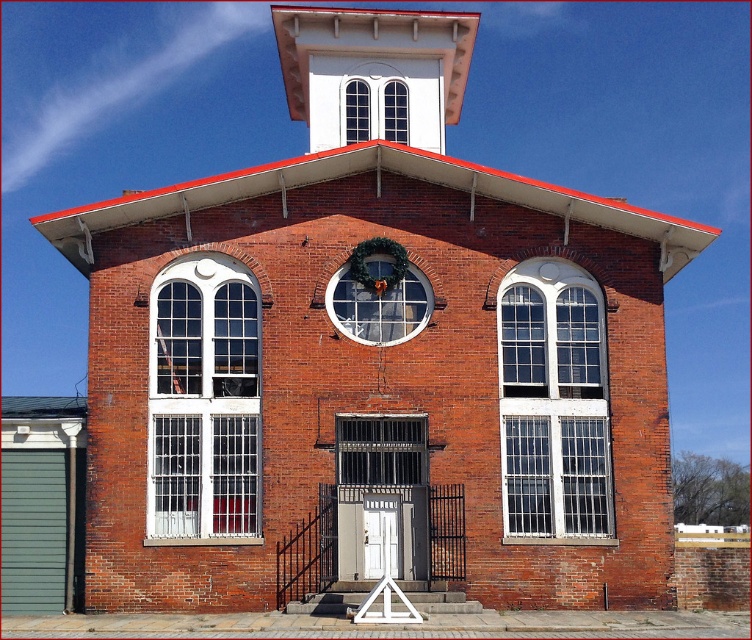
Question: Does green wreath at center appear over clear glass window at upper center?

Choices:
 (A) no
 (B) yes

Answer: (A)

Question: Which object appears farthest from the camera in this image?

Choices:
 (A) white textured glass window at right
 (B) green wreath at center
 (C) clear glass window at upper center

Answer: (C)

Question: Can you confirm if white glass window at left is positioned below clear glass window at upper center?

Choices:
 (A) no
 (B) yes

Answer: (B)

Question: Which object is the closest to the white textured glass window at right?

Choices:
 (A) clear glass window at upper center
 (B) white glass window at left

Answer: (B)

Question: Does green wreath at center appear under clear glass window at upper center?

Choices:
 (A) yes
 (B) no

Answer: (A)

Question: Which of the following is the farthest from the observer?

Choices:
 (A) (396, 323)
 (B) (602, 468)
 (C) (226, 273)
 (D) (381, 136)

Answer: (D)